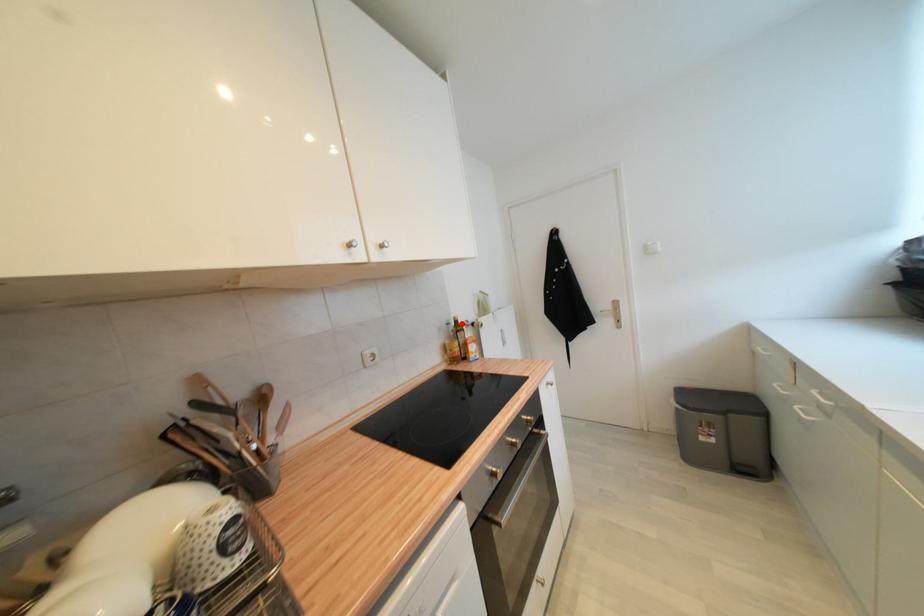
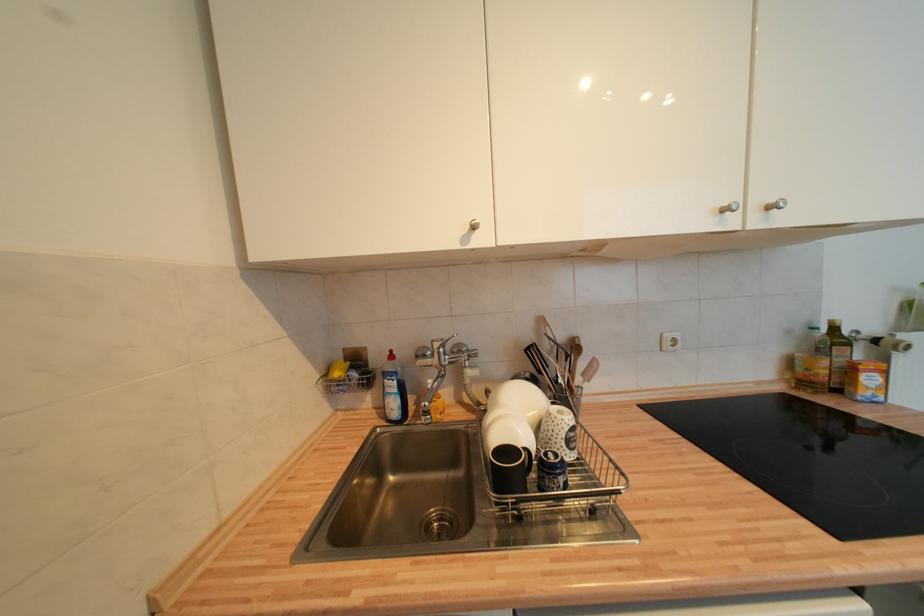
The point at the highlighted location is marked in the first image. Where is the corresponding point in the second image?

(840, 331)